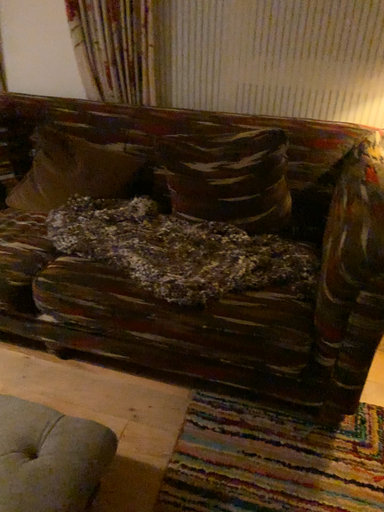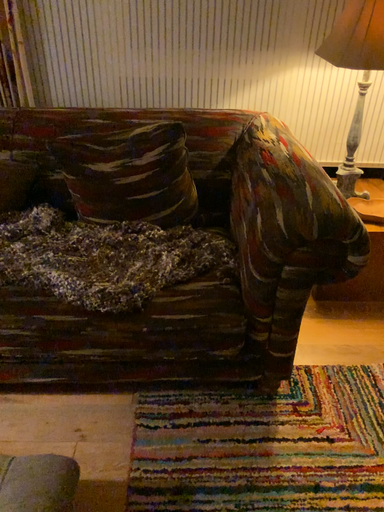
Question: How did the camera likely rotate when shooting the video?

Choices:
 (A) rotated left
 (B) rotated right

Answer: (B)